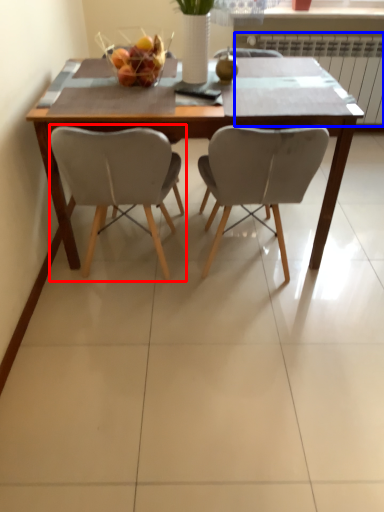
Question: Which object appears farthest to the camera in this image, chair (highlighted by a red box) or radiator (highlighted by a blue box)?

Choices:
 (A) chair
 (B) radiator

Answer: (B)